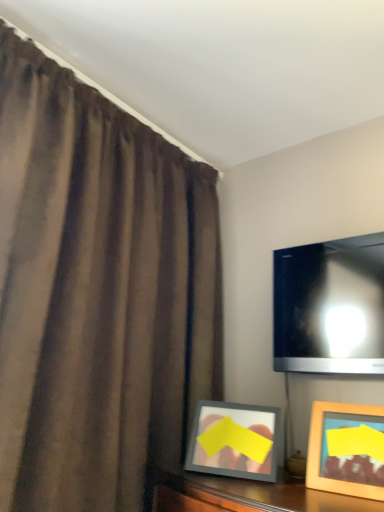
Question: From a real-world perspective, is wooden picture frame at lower right beneath brown matte curtain at left?

Choices:
 (A) no
 (B) yes

Answer: (B)

Question: From a real-world perspective, is wooden picture frame at lower right over brown matte curtain at left?

Choices:
 (A) no
 (B) yes

Answer: (A)

Question: Is wooden picture frame at lower right to the left of brown matte curtain at left from the viewer's perspective?

Choices:
 (A) yes
 (B) no

Answer: (B)

Question: Is wooden picture frame at lower right positioned far away from brown matte curtain at left?

Choices:
 (A) yes
 (B) no

Answer: (B)

Question: Is wooden picture frame at lower right touching brown matte curtain at left?

Choices:
 (A) yes
 (B) no

Answer: (B)

Question: Does wooden picture frame at lower right have a lesser width compared to brown matte curtain at left?

Choices:
 (A) no
 (B) yes

Answer: (B)

Question: Could you tell me if matte black tv at upper right is facing brown matte curtain at left?

Choices:
 (A) no
 (B) yes

Answer: (A)

Question: From the image's perspective, is matte black tv at upper right located above brown matte curtain at left?

Choices:
 (A) yes
 (B) no

Answer: (B)

Question: Is matte black tv at upper right bigger than brown matte curtain at left?

Choices:
 (A) yes
 (B) no

Answer: (B)

Question: Can you confirm if matte black tv at upper right is thinner than brown matte curtain at left?

Choices:
 (A) yes
 (B) no

Answer: (A)

Question: Is matte black tv at upper right surrounding brown matte curtain at left?

Choices:
 (A) no
 (B) yes

Answer: (A)

Question: Can you confirm if matte black tv at upper right is shorter than brown matte curtain at left?

Choices:
 (A) yes
 (B) no

Answer: (A)

Question: Are brown matte curtain at left and matte black tv at upper right making contact?

Choices:
 (A) no
 (B) yes

Answer: (A)